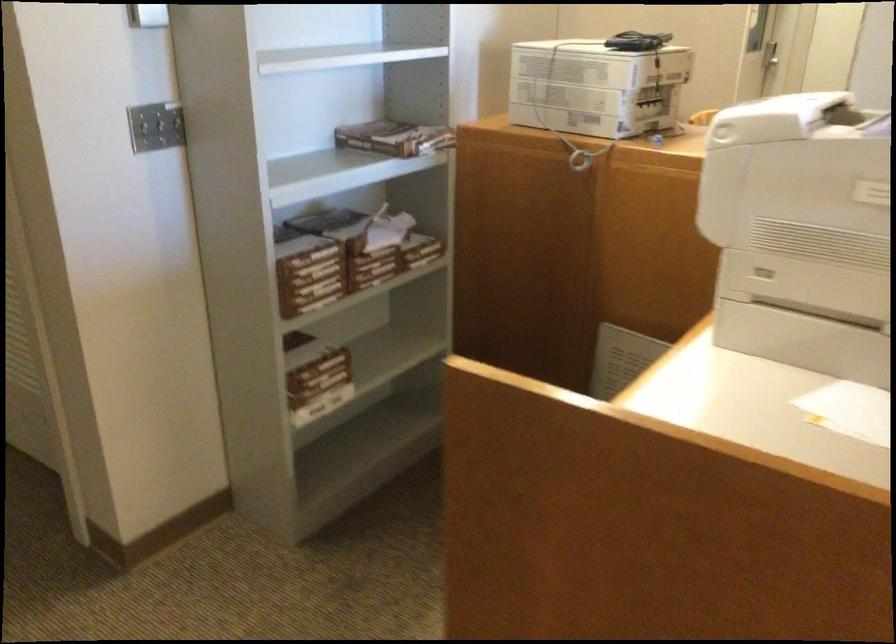
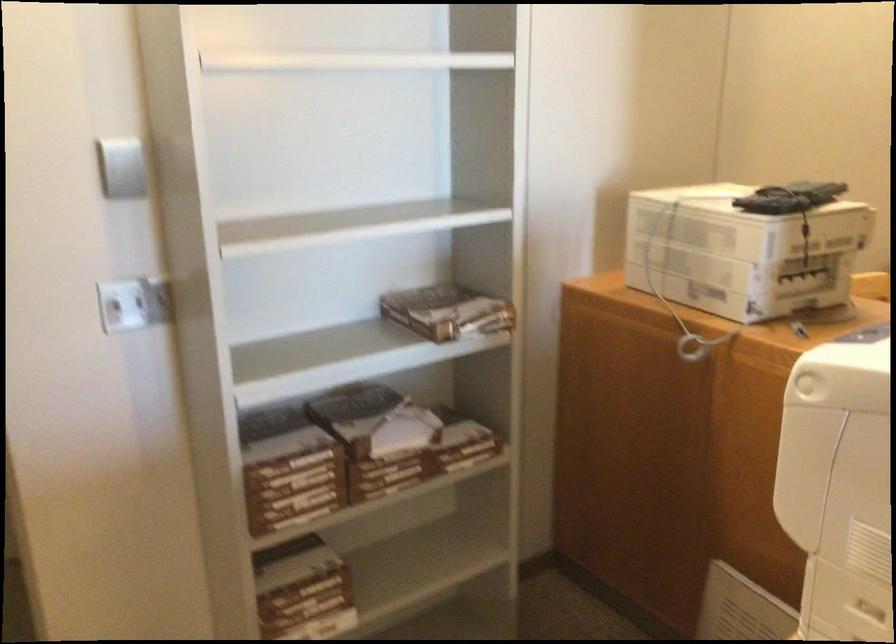
Question: The camera is either moving clockwise (left) or counter-clockwise (right) around the object. The first image is from the beginning of the video and the second image is from the end. Is the camera moving left or right when shooting the video?

Choices:
 (A) Left
 (B) Right

Answer: (B)